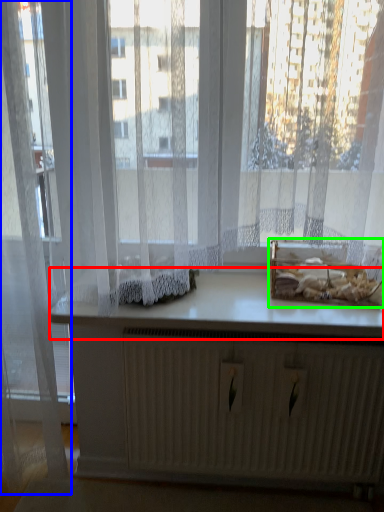
Question: Based on their relative distances, which object is nearer to counter top (highlighted by a red box)? Choose from curtain (highlighted by a blue box) and cardboard box (highlighted by a green box).

Choices:
 (A) curtain
 (B) cardboard box

Answer: (B)